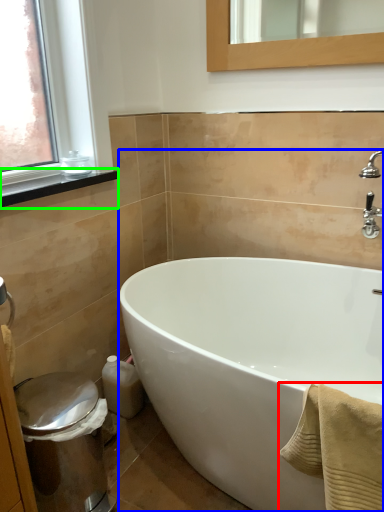
Question: Which is farther away from bath towel (highlighted by a red box)? bathtub (highlighted by a blue box) or window sill (highlighted by a green box)?

Choices:
 (A) bathtub
 (B) window sill

Answer: (B)